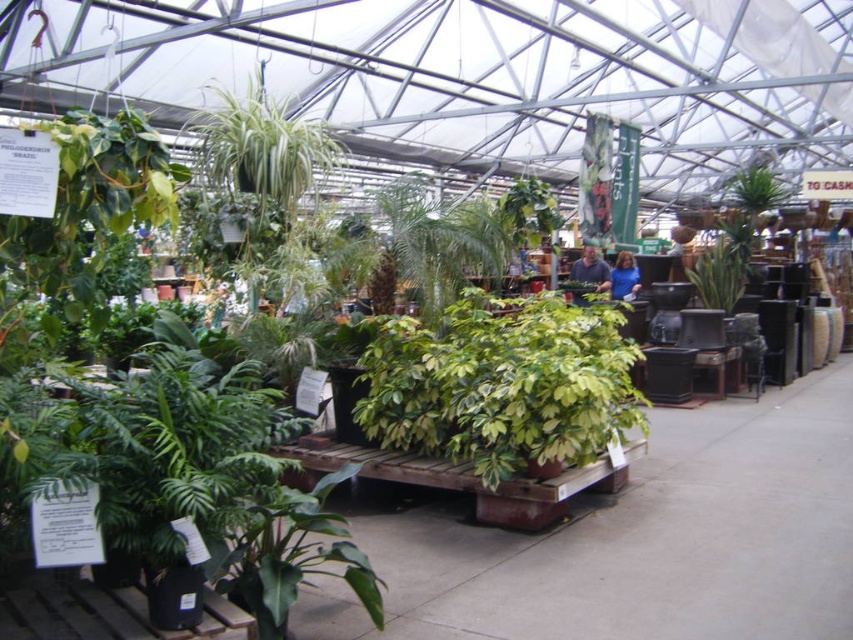
You are a customer in the greenhouse and want to examine both the green matte leafy plant at lower center and the green leafy plant at upper center. Which one do you need to walk towards first to get a closer look?

You should first walk towards the green matte leafy plant at lower center because it is closer to you than the green leafy plant at upper center.

You are a customer in the greenhouse and want to place a new pot between the green leafy plant at upper center and the green glossy planter at center. Which object should you use as a reference for height to ensure the new pot is taller than both?

The green glossy planter at center is taller than the green leafy plant at upper center, so you should use the green glossy planter at center as a reference to ensure the new pot is taller than both.

You are a gardener who wants to place a new plant stand that is 1.2 meters tall. You have two options in the greenhouse, the green matte leafy plant at lower center and the green leafy plant at upper center. Which plant should you choose to place the stand next to so that the stand is shorter than the plant?

The green leafy plant at upper center is taller than the green matte leafy plant at lower center. Therefore, placing the 1.2 meter tall plant stand next to the green leafy plant at upper center would ensure the stand is shorter than the plant.